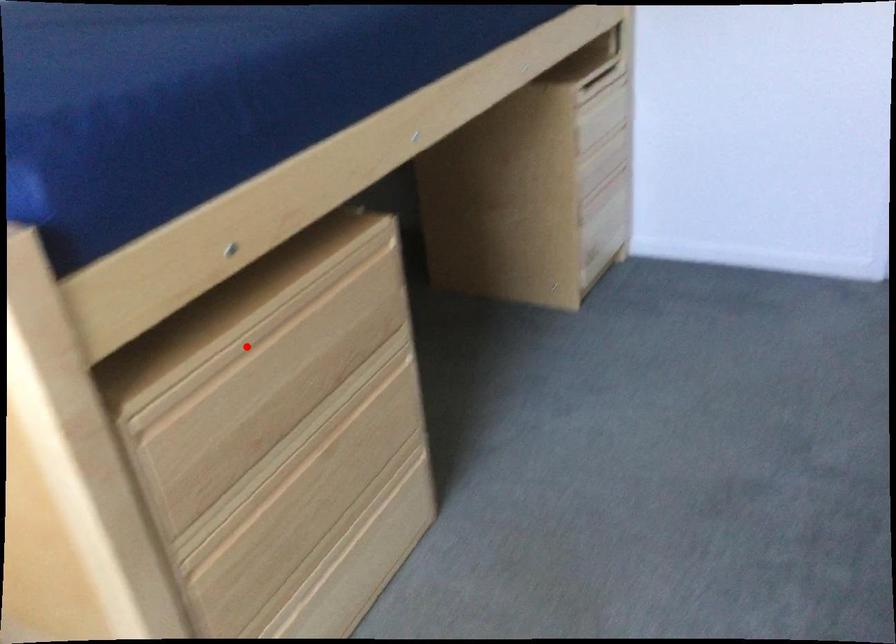
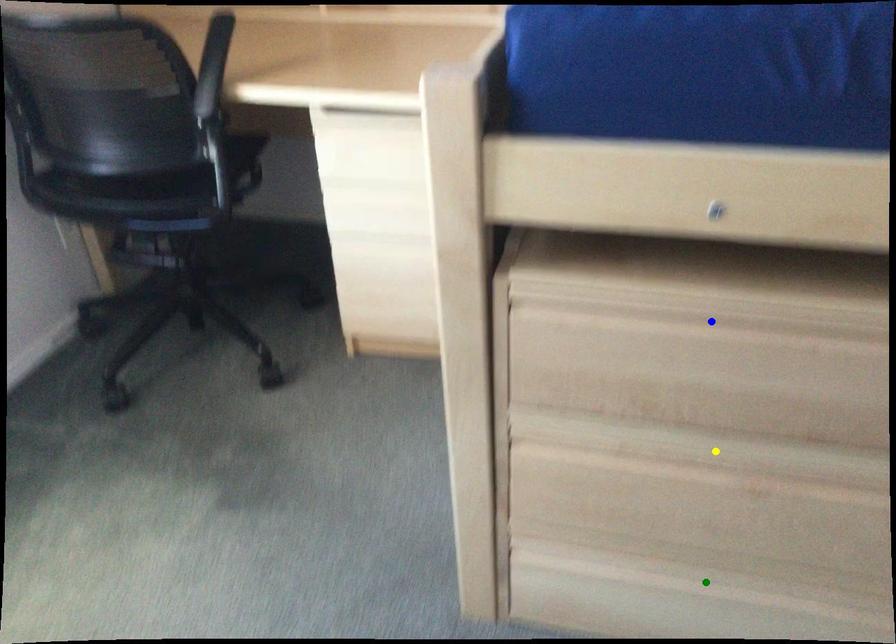
Question: I am providing you with two images of the same scene from different viewpoints. A red point is marked on the first image. You are given multiple points on the second image. In image 2, which mark is for the same physical point as the one in image 1?

Choices:
 (A) green point
 (B) yellow point
 (C) blue point

Answer: (C)